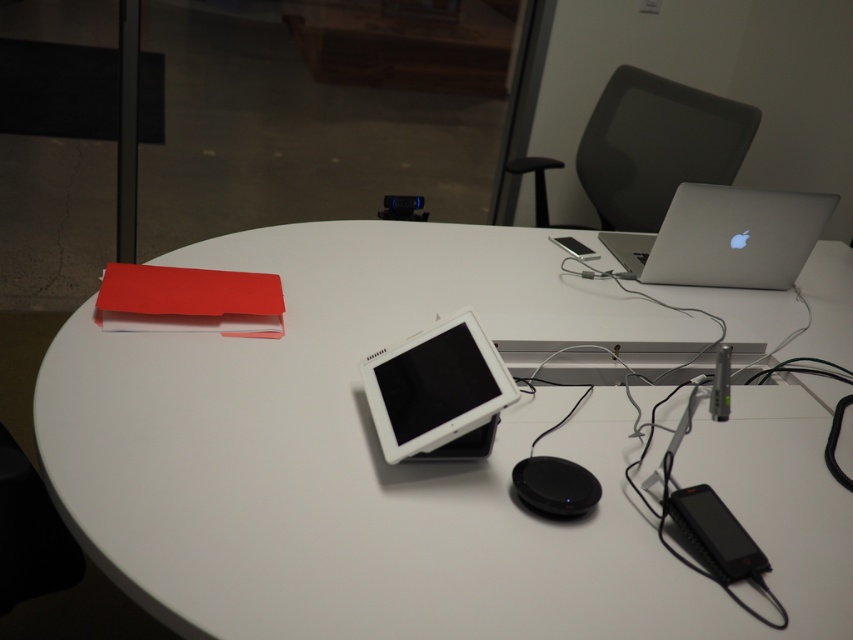
Between point (712, 240) and point (459, 422), which one is positioned in front?

Point (459, 422) is in front.

Who is shorter, silver metallic laptop at upper right or white glossy tablet at center?

With less height is silver metallic laptop at upper right.

Which is behind, point (669, 268) or point (498, 406)?

The point (669, 268) is behind.

Where is `silver metallic laptop at upper right`? The width and height of the screenshot is (853, 640). silver metallic laptop at upper right is located at coordinates click(726, 237).

Between white glossy table at upper left and silver metallic laptop at upper right, which one is positioned higher?

silver metallic laptop at upper right

Measure the distance between white glossy table at upper left and silver metallic laptop at upper right.

15.96 inches

The width and height of the screenshot is (853, 640). I want to click on white glossy table at upper left, so click(364, 451).

Find the location of `white glossy table at upper left`. white glossy table at upper left is located at coordinates (364, 451).

Does white glossy table at upper left appear under white glossy tablet at center?

No, white glossy table at upper left is not below white glossy tablet at center.

Does point (204, 416) lie behind point (438, 445)?

That is True.

The width and height of the screenshot is (853, 640). I want to click on white glossy table at upper left, so click(x=364, y=451).